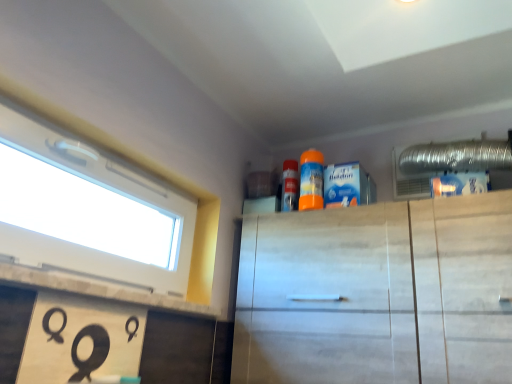
Measure the distance between point (312, 192) and camera.

5.37 feet.

What are the coordinates of `orange matte spray can at upper center` in the screenshot? It's located at (311, 180).

Locate an element on the screen. This screenshot has width=512, height=384. white plastic window at upper left is located at coordinates (88, 211).

Where is `white marble cabinet at upper center`? white marble cabinet at upper center is located at coordinates (378, 294).

Based on the photo, from the image's perspective, which object appears higher, white plastic window at upper left or white marble cabinet at upper center?

white plastic window at upper left appears higher in the image.

Is white plastic window at upper left looking in the opposite direction of white marble cabinet at upper center?

That's not correct — white plastic window at upper left is not looking away from white marble cabinet at upper center.

Where is `cabinetry located below the white plastic window at upper left (from the image's perspective)`? The width and height of the screenshot is (512, 384). cabinetry located below the white plastic window at upper left (from the image's perspective) is located at coordinates (378, 294).

Is white plastic window at upper left at the right side of white marble cabinet at upper center?

Incorrect, white plastic window at upper left is not on the right side of white marble cabinet at upper center.

Considering the sizes of objects white marble cabinet at upper center and orange matte spray can at upper center in the image provided, who is wider, white marble cabinet at upper center or orange matte spray can at upper center?

With larger width is white marble cabinet at upper center.

Is white marble cabinet at upper center behind orange matte spray can at upper center?

No, white marble cabinet at upper center is closer to the viewer.

Who is shorter, white marble cabinet at upper center or orange matte spray can at upper center?

orange matte spray can at upper center.

Does orange matte spray can at upper center have a smaller size compared to white marble cabinet at upper center?

Yes.

Could you tell me if orange matte spray can at upper center is facing white marble cabinet at upper center?

No, orange matte spray can at upper center does not turn towards white marble cabinet at upper center.

From the image's perspective, is orange matte spray can at upper center positioned above or below white marble cabinet at upper center?

Based on their image positions, orange matte spray can at upper center is located above white marble cabinet at upper center.

How much distance is there between white plastic window at upper left and orange matte spray can at upper center?

white plastic window at upper left is 1.04 meters from orange matte spray can at upper center.

From the image's perspective, is white plastic window at upper left on top of orange matte spray can at upper center?

No.

Is white plastic window at upper left closer to the viewer compared to orange matte spray can at upper center?

Yes.

Can you confirm if white plastic window at upper left is thinner than orange matte spray can at upper center?

No, white plastic window at upper left is not thinner than orange matte spray can at upper center.

Who is bigger, white marble cabinet at upper center or white plastic window at upper left?

Bigger between the two is white marble cabinet at upper center.

How far apart are white marble cabinet at upper center and white plastic window at upper left?

A distance of 30.75 inches exists between white marble cabinet at upper center and white plastic window at upper left.

Is white marble cabinet at upper center inside or outside of white plastic window at upper left?

white marble cabinet at upper center is spatially situated outside white plastic window at upper left.

Is the position of white marble cabinet at upper center more distant than that of white plastic window at upper left?

Yes, the depth of white marble cabinet at upper center is greater than that of white plastic window at upper left.

Is orange matte spray can at upper center outside of white plastic window at upper left?

Yes, orange matte spray can at upper center is outside of white plastic window at upper left.

Based on the photo, could you tell me if orange matte spray can at upper center is turned towards white plastic window at upper left?

No, orange matte spray can at upper center is not aimed at white plastic window at upper left.

Does orange matte spray can at upper center touch white plastic window at upper left?

No, orange matte spray can at upper center is not making contact with white plastic window at upper left.

Looking at this image, which of these two, orange matte spray can at upper center or white plastic window at upper left, stands shorter?

orange matte spray can at upper center.

Locate an element on the screen. The width and height of the screenshot is (512, 384). cabinetry on the right of white plastic window at upper left is located at coordinates (378, 294).

Identify the location of cabinetry in front of the orange matte spray can at upper center. The image size is (512, 384). (378, 294).

Estimate the real-world distances between objects in this image. Which object is further from white plastic window at upper left, orange matte spray can at upper center or white marble cabinet at upper center?

orange matte spray can at upper center lies further to white plastic window at upper left than the other object.

When comparing their distances from white marble cabinet at upper center, does white plastic window at upper left or orange matte spray can at upper center seem closer?

orange matte spray can at upper center lies closer to white marble cabinet at upper center than the other object.

Consider the image. Which object lies nearer to the anchor point orange matte spray can at upper center, white marble cabinet at upper center or white plastic window at upper left?

Result: Based on the image, white marble cabinet at upper center appears to be nearer to orange matte spray can at upper center.

Based on the photo, when comparing their distances from white plastic window at upper left, does white marble cabinet at upper center or orange matte spray can at upper center seem closer?

Among the two, white marble cabinet at upper center is located nearer to white plastic window at upper left.

Considering their positions, is orange matte spray can at upper center positioned closer to white marble cabinet at upper center than white plastic window at upper left?

orange matte spray can at upper center is positioned closer to the anchor white marble cabinet at upper center.

Considering their positions, is white plastic window at upper left positioned closer to orange matte spray can at upper center than white marble cabinet at upper center?

white marble cabinet at upper center.

You are a GUI agent. You are given a task and a screenshot of the screen. Output one action in this format:
    pyautogui.click(x=<x>, y=<y>)
    Task: Click on the cleaning product between white plastic window at upper left and white marble cabinet at upper center from left to right
    
    Given the screenshot: What is the action you would take?
    pyautogui.click(x=311, y=180)